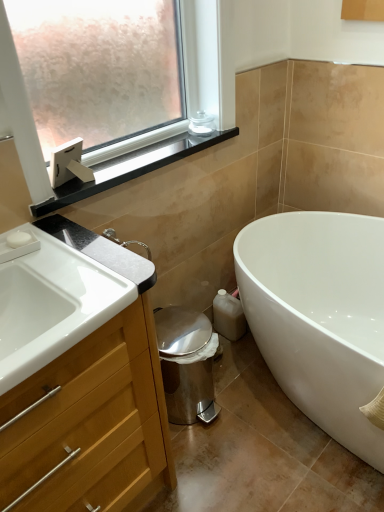
In order to click on free space above black glossy window sill at upper left (from a real-world perspective) in this screenshot , I will do `click(135, 151)`.